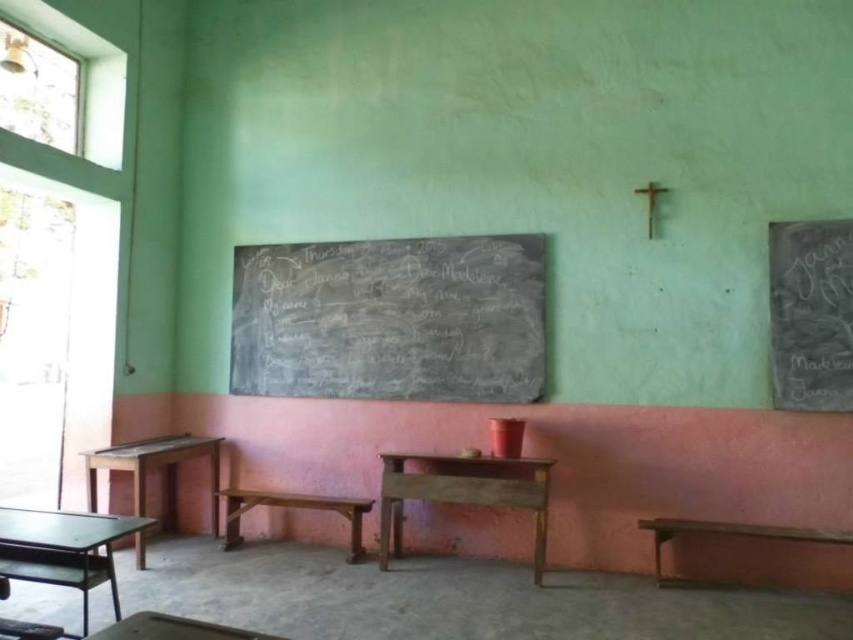
You are a student who needs to place a textbook on the wooden table at center and the wooden stool at center. Which surface will allow the textbook to be placed higher from the floor?

The wooden table at center has a greater height compared to the wooden stool at center, so placing the textbook on the wooden table at center will result in it being higher from the floor.

You are a student standing in the classroom and need to write something on the white chalkboard at right and the wooden table at center. Which surface will require you to step closer to reach the top edge?

The white chalkboard at right has a smaller size compared to the wooden table at center, so it is likely shorter. Therefore, you would need to step closer to reach the top edge of the white chalkboard at right.

In the scene shown: You are a student standing in front of the classroom. You need to hang a poster on the wall. Which object, the black chalkboard at center or the wooden table at lower center, would be a better choice for hanging the poster due to its height?

The black chalkboard at center is much taller than the wooden table at lower center, so it would be a better choice for hanging the poster due to its height.